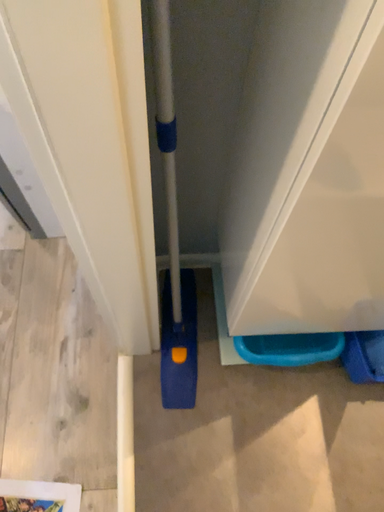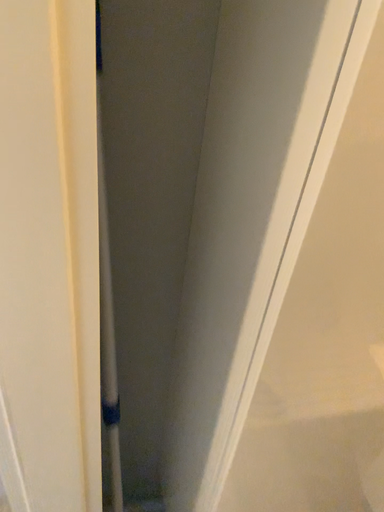
Question: Which way did the camera rotate in the video?

Choices:
 (A) rotated downward
 (B) rotated upward

Answer: (B)